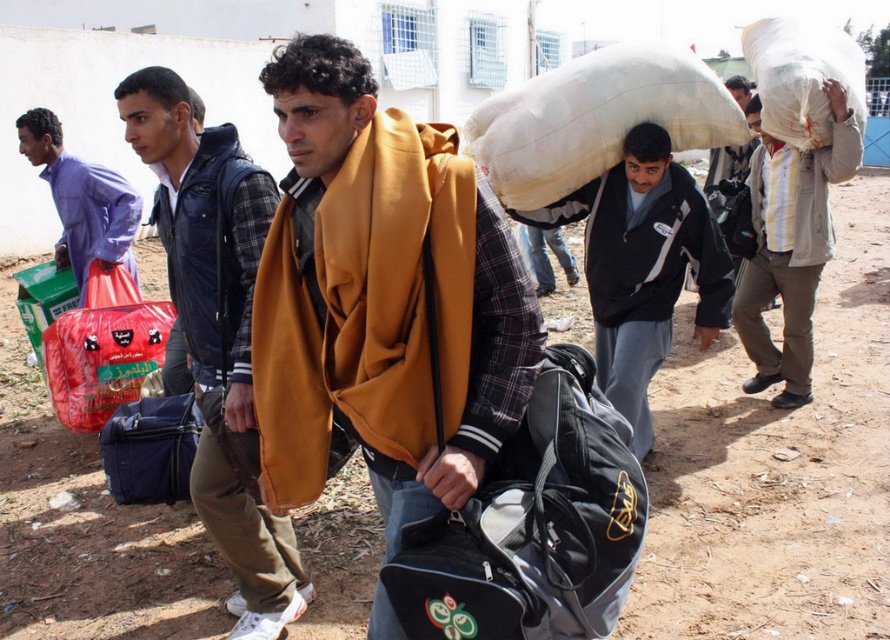
Question: Which object is farther from the camera taking this photo?

Choices:
 (A) white fabric sack at upper right
 (B) black fabric bag at center
 (C) dark gray fleece jacket at center
 (D) red plastic bag at center

Answer: (D)

Question: Does dirt field at center appear on the left side of flannel shirt at center?

Choices:
 (A) no
 (B) yes

Answer: (B)

Question: Does matte yellow jacket at center lie behind white fabric sack at upper right?

Choices:
 (A) no
 (B) yes

Answer: (A)

Question: Which point appears closest to the camera in this image?

Choices:
 (A) (620, 109)
 (B) (851, 108)

Answer: (A)

Question: Which point is farther from the camera taking this photo?

Choices:
 (A) (49, 122)
 (B) (239, 234)
 (C) (110, 340)
 (D) (708, 92)

Answer: (A)

Question: Is white fabric sack at upper right bigger than red plastic bag at center?

Choices:
 (A) yes
 (B) no

Answer: (A)